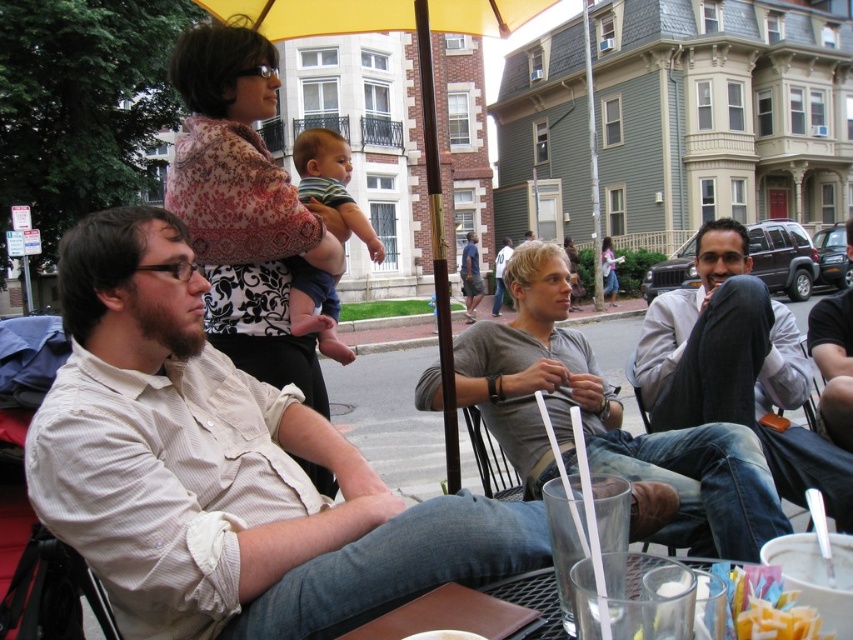
You are a barista at the outdoor patio and need to place a new drink order on the table. The drink is in a container that is the same size as the clear glass at lower center. Is there enough space next to the light gray sweater at right to place the new drink?

The light gray sweater at right is bigger than the clear glass at lower center. Since the new drink container is the same size as the clear glass at lower center, there should be enough space next to the light gray sweater at right to place the new drink, as the sweater itself does not block the entire area.